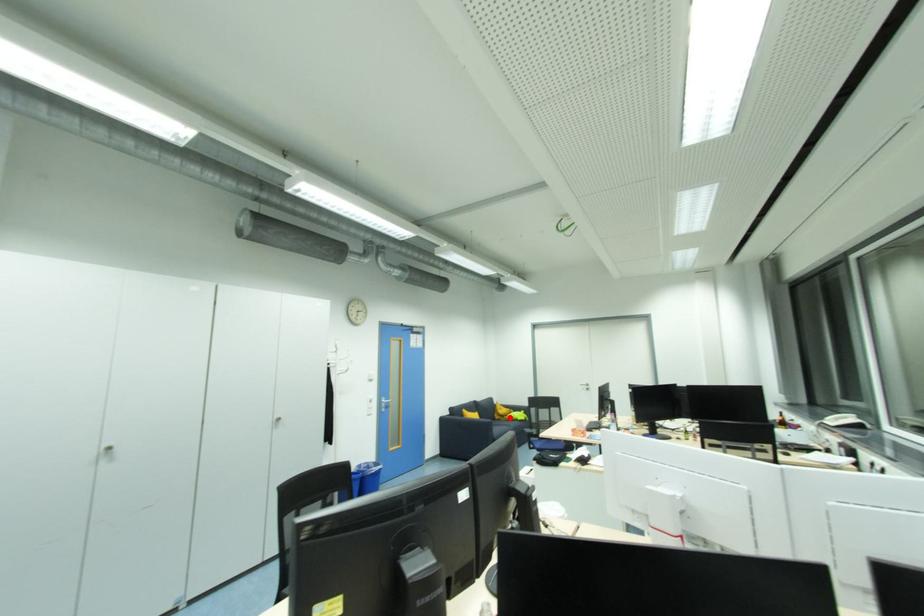
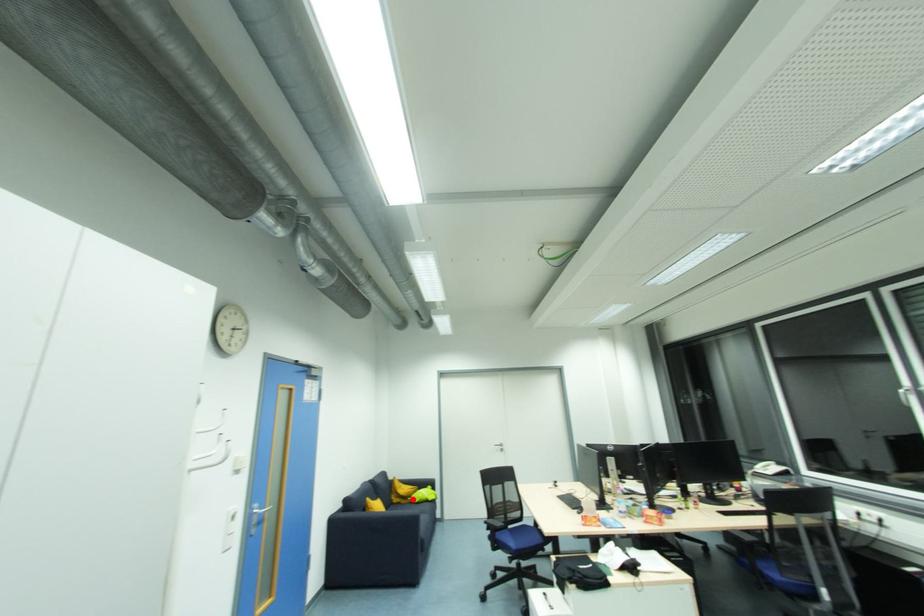
I am providing you with two images of the same scene from different viewpoints. A red point is marked on the first image and another point is marked on the second image. Is the red point in image1 aligned with the point shown in image2?

Yes